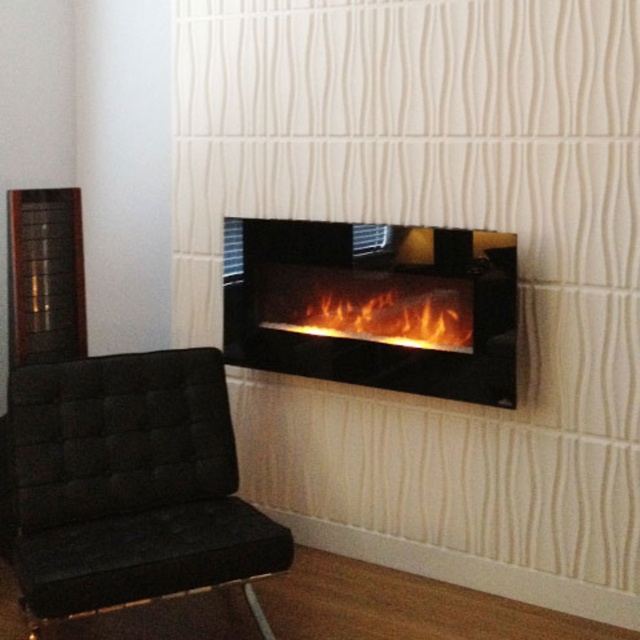
Question: Which point is closer to the camera taking this photo?

Choices:
 (A) (113, 492)
 (B) (456, 304)
 (C) (314, 332)

Answer: (A)

Question: Which object is closer to the camera taking this photo?

Choices:
 (A) black glass fireplace at center
 (B) flametransparent glass/black frame at center
 (C) black fabric armchair at left

Answer: (C)

Question: Which object is closer to the camera taking this photo?

Choices:
 (A) black glass fireplace at center
 (B) black fabric armchair at left
 (C) flametransparent glass/black frame at center

Answer: (B)

Question: Can you confirm if black fabric armchair at left is positioned above black glass fireplace at center?

Choices:
 (A) no
 (B) yes

Answer: (A)

Question: Can you confirm if black fabric armchair at left is positioned below black glass fireplace at center?

Choices:
 (A) yes
 (B) no

Answer: (A)

Question: Can you confirm if black fabric armchair at left is positioned below flametransparent glass/black frame at center?

Choices:
 (A) no
 (B) yes

Answer: (B)